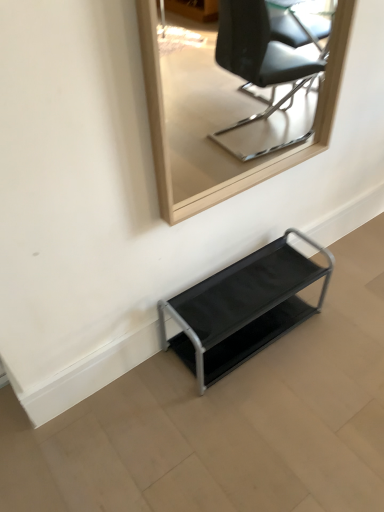
The height and width of the screenshot is (512, 384). In order to click on vacant area that is in front of metallic gray shelf at lower center in this screenshot , I will do click(256, 425).